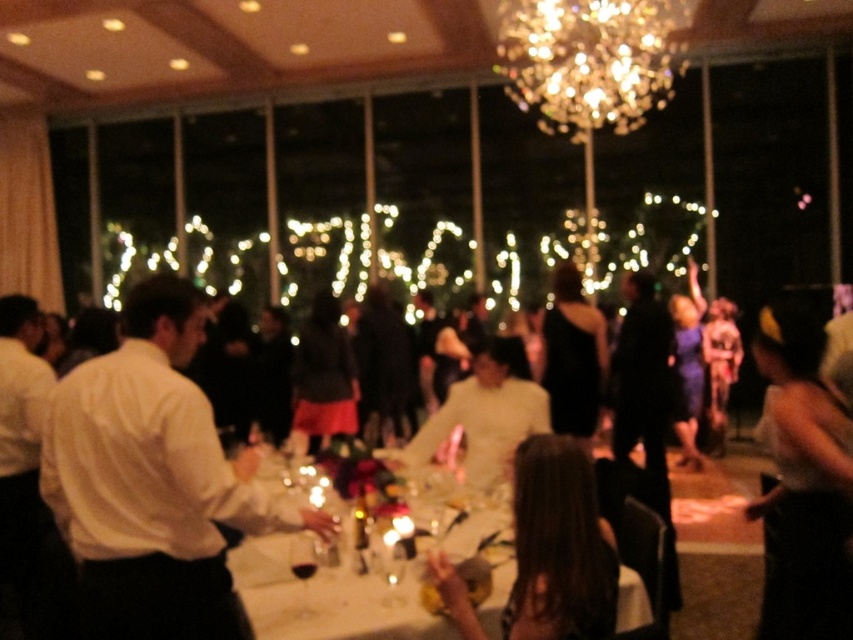
Between point (612, 605) and point (705, 508), which one is positioned in front?

Point (612, 605)

You are a GUI agent. You are given a task and a screenshot of the screen. Output one action in this format:
    pyautogui.click(x=<x>, y=<y>)
    Task: Click on the dark brown hair at center
    This screenshot has width=853, height=640.
    Given the screenshot: What is the action you would take?
    pyautogui.click(x=560, y=547)

You are a GUI agent. You are given a task and a screenshot of the screen. Output one action in this format:
    pyautogui.click(x=<x>, y=<y>)
    Task: Click on the black satin dress at lower right
    This screenshot has height=640, width=853.
    Given the screenshot: What is the action you would take?
    pyautogui.click(x=804, y=484)

Which is above, black satin dress at lower right or white glossy table at center?

black satin dress at lower right is higher up.

Is point (776, 376) in front of point (277, 563)?

Yes.

Identify the location of black satin dress at lower right. This screenshot has width=853, height=640. (804, 484).

Does dark brown hair at center have a lesser height compared to transparent glass wine at lower center?

Incorrect, dark brown hair at center's height does not fall short of transparent glass wine at lower center's.

Is dark brown hair at center bigger than transparent glass wine at lower center?

Correct, dark brown hair at center is larger in size than transparent glass wine at lower center.

Who is more distant from viewer, (596, 525) or (310, 557)?

The point (310, 557) is behind.

You are a GUI agent. You are given a task and a screenshot of the screen. Output one action in this format:
    pyautogui.click(x=<x>, y=<y>)
    Task: Click on the dark brown hair at center
    
    Given the screenshot: What is the action you would take?
    pyautogui.click(x=560, y=547)